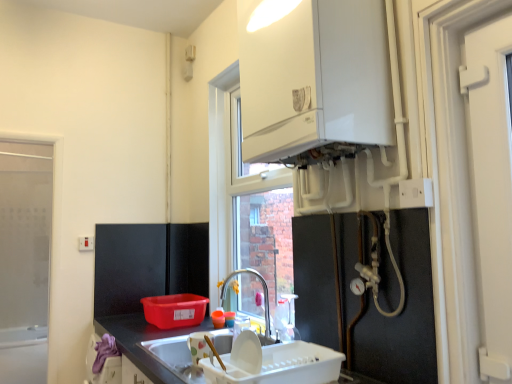
Question: Is white glossy boiler at upper center situated inside white plastic electric outlet at upper left, the second electric outlet positioned from the top, or outside?

Choices:
 (A) outside
 (B) inside

Answer: (A)

Question: Is white glossy boiler at upper center wider or thinner than white plastic electric outlet at upper left, which is the second electric outlet from front to back?

Choices:
 (A) wide
 (B) thin

Answer: (A)

Question: Which is nearer to the white glossy boiler at upper center?

Choices:
 (A) metallic silver pipes at lower right, the 1th appliance when ordered from top to bottom
 (B) white matte door at right
 (C) silver metallic faucet at center
 (D) white plastic dish rack at lower center, acting as the 2th appliance starting from the top
 (E) white plastic electrical outlet at upper right, arranged as the second electric outlet when viewed from the back

Answer: (E)

Question: Based on their relative distances, which object is nearer to the transparent glass window at left?

Choices:
 (A) silver metallic faucet at center
 (B) white glossy boiler at upper center
 (C) white plastic electrical outlet at upper right, which ranks as the 2th electric outlet in bottom-to-top order
 (D) white plastic dish rack at lower center, acting as the 2th appliance starting from the top
 (E) metallic silver pipes at lower right, acting as the 2th appliance starting from the bottom

Answer: (A)